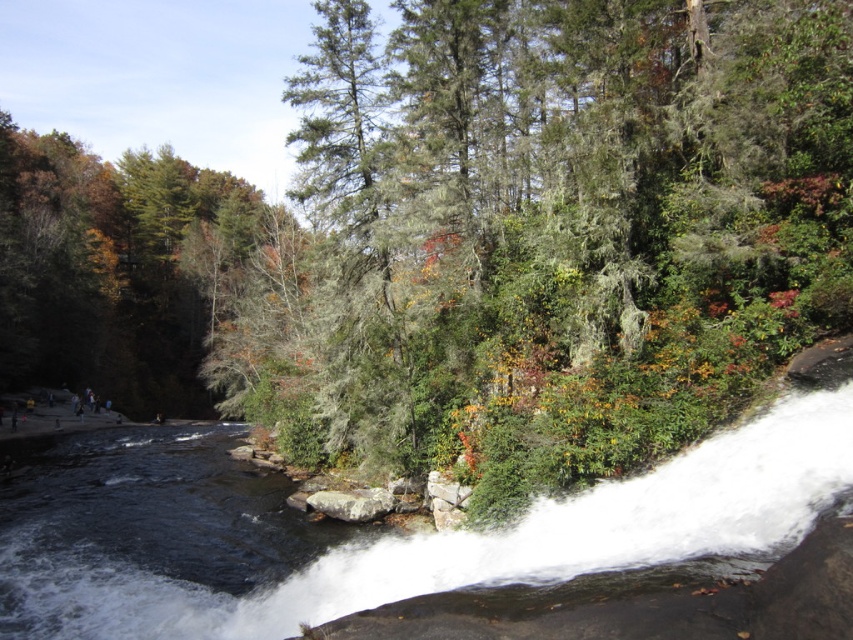
Question: Which object appears closest to the camera in this image?

Choices:
 (A) gray rough rock at center
 (B) white frothy water at lower center

Answer: (B)

Question: Does white frothy water at lower center have a larger size compared to gray rough rock at center?

Choices:
 (A) no
 (B) yes

Answer: (B)

Question: In this image, where is white frothy water at lower center located relative to gray rough rock at center?

Choices:
 (A) below
 (B) above

Answer: (B)

Question: Which point is closer to the camera?

Choices:
 (A) (351, 497)
 (B) (181, 481)

Answer: (A)

Question: Is white frothy water at lower center thinner than gray rough rock at center?

Choices:
 (A) yes
 (B) no

Answer: (B)

Question: Which of the following is the farthest from the observer?

Choices:
 (A) click(x=730, y=540)
 (B) click(x=334, y=499)

Answer: (B)